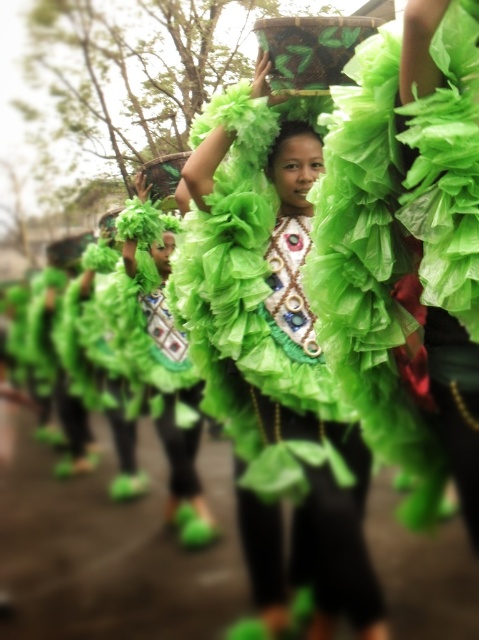
Which is more to the left, green fabric dress at center or ruffled green dress at center?

ruffled green dress at center is more to the left.

Based on the photo, is green fabric dress at center shorter than ruffled green dress at center?

In fact, green fabric dress at center may be taller than ruffled green dress at center.

Where is `green fabric dress at center`? The height and width of the screenshot is (640, 479). green fabric dress at center is located at coordinates tap(271, 346).

Identify the location of green fabric dress at center. (271, 346).